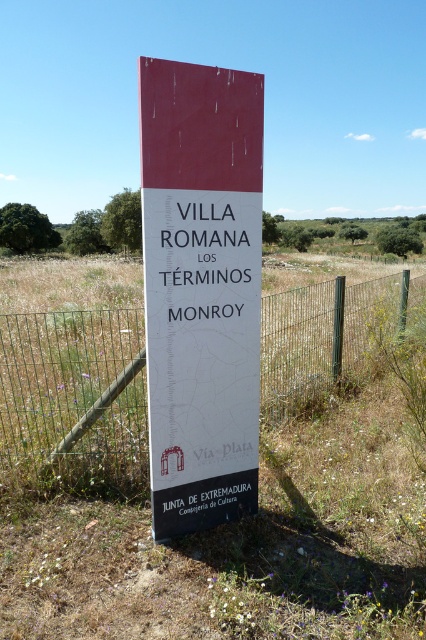
Can you confirm if metal wire fence at center is positioned above black metal pole at center?

Yes.

The width and height of the screenshot is (426, 640). Describe the element at coordinates (74, 396) in the screenshot. I see `metal wire fence at center` at that location.

The width and height of the screenshot is (426, 640). Identify the location of metal wire fence at center. (74, 396).

Does matte red sign at center lie behind metal wire fence at center?

No, matte red sign at center is in front of metal wire fence at center.

Where is `matte red sign at center`? Image resolution: width=426 pixels, height=640 pixels. matte red sign at center is located at coordinates (201, 289).

Can you confirm if matte red sign at center is positioned to the right of black metal pole at center?

No, matte red sign at center is not to the right of black metal pole at center.

Between matte red sign at center and black metal pole at center, which one appears on the right side from the viewer's perspective?

black metal pole at center is more to the right.

Where is `matte red sign at center`? This screenshot has height=640, width=426. matte red sign at center is located at coordinates (201, 289).

At what (x,y) coordinates should I click in order to perform the action: click on matte red sign at center. Please return your answer as a coordinate pair (x, y). Image resolution: width=426 pixels, height=640 pixels. Looking at the image, I should click on (201, 289).